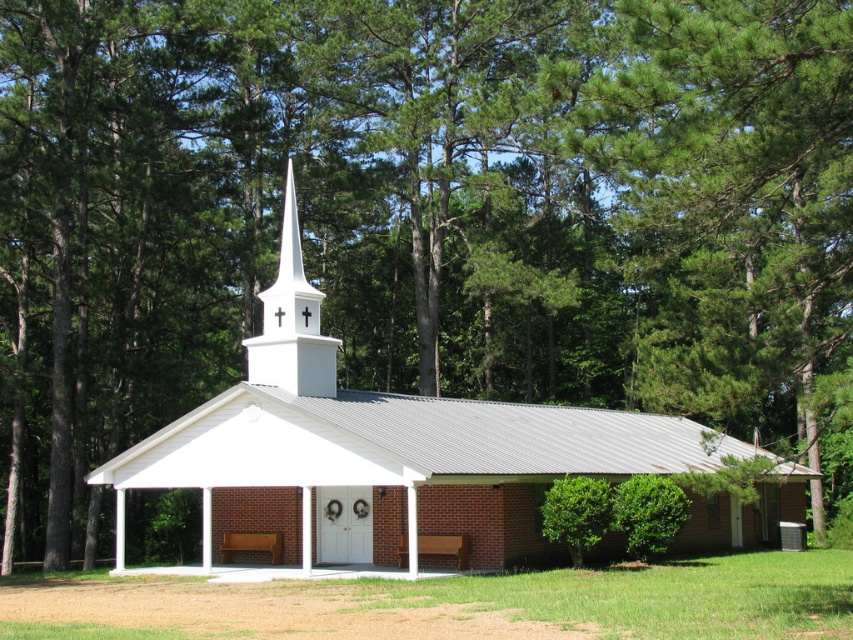
Question: Which point is farther to the camera?

Choices:
 (A) (305, 285)
 (B) (329, 346)
 (C) (262, 536)

Answer: (C)

Question: Can you confirm if white brick church at center is wider than white matte steeple at center?

Choices:
 (A) yes
 (B) no

Answer: (A)

Question: Among these points, which one is nearest to the camera?

Choices:
 (A) (236, 547)
 (B) (440, 536)
 (C) (280, 344)

Answer: (B)

Question: Considering the relative positions of white brick church at center and brown wooden bench at lower center in the image provided, where is white brick church at center located with respect to brown wooden bench at lower center?

Choices:
 (A) below
 (B) above

Answer: (B)

Question: Can you confirm if white matte steeple at center is bigger than brown wooden bench at lower center?

Choices:
 (A) yes
 (B) no

Answer: (A)

Question: Which point appears farthest from the camera in this image?

Choices:
 (A) (271, 316)
 (B) (445, 538)

Answer: (A)